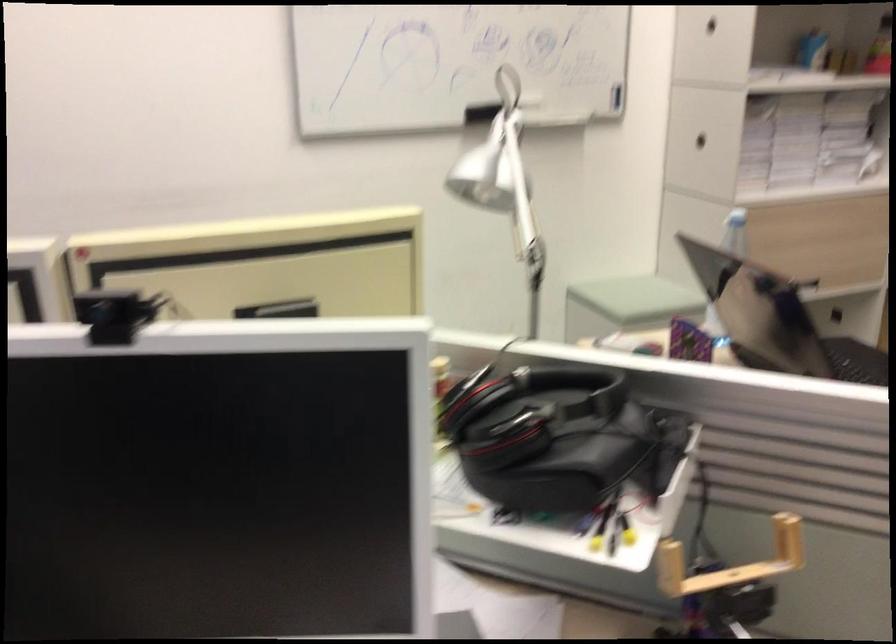
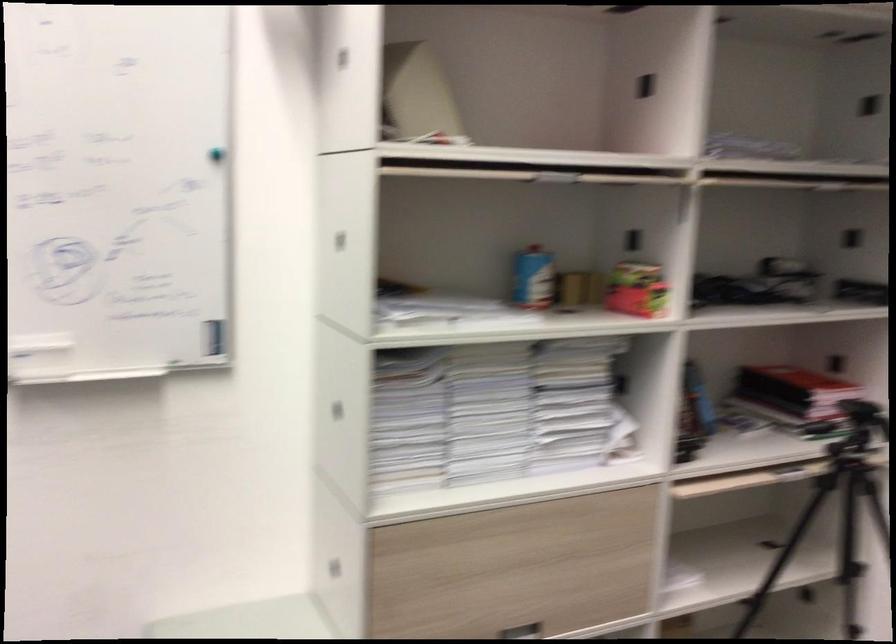
Where in the second image is the point corresponding to (x=800, y=136) from the first image?

(489, 412)